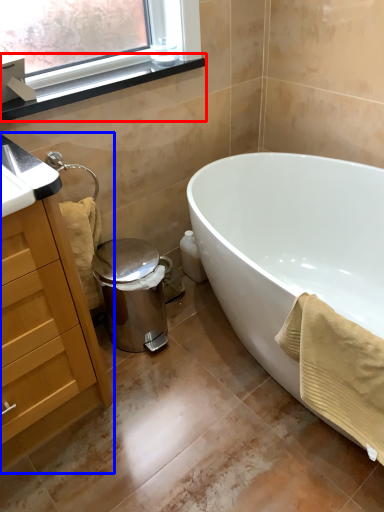
Question: Which point is closer to the camera, window sill (highlighted by a red box) or cabinetry (highlighted by a blue box)?

Choices:
 (A) window sill
 (B) cabinetry

Answer: (B)